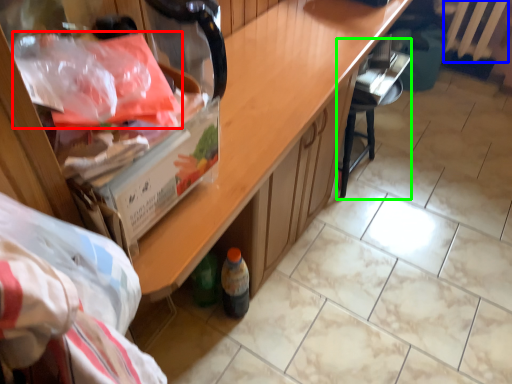
Question: Estimate the real-world distances between objects in this image. Which object is closer to material (highlighted by a red box), radiator (highlighted by a blue box) or chair (highlighted by a green box)?

Choices:
 (A) radiator
 (B) chair

Answer: (B)